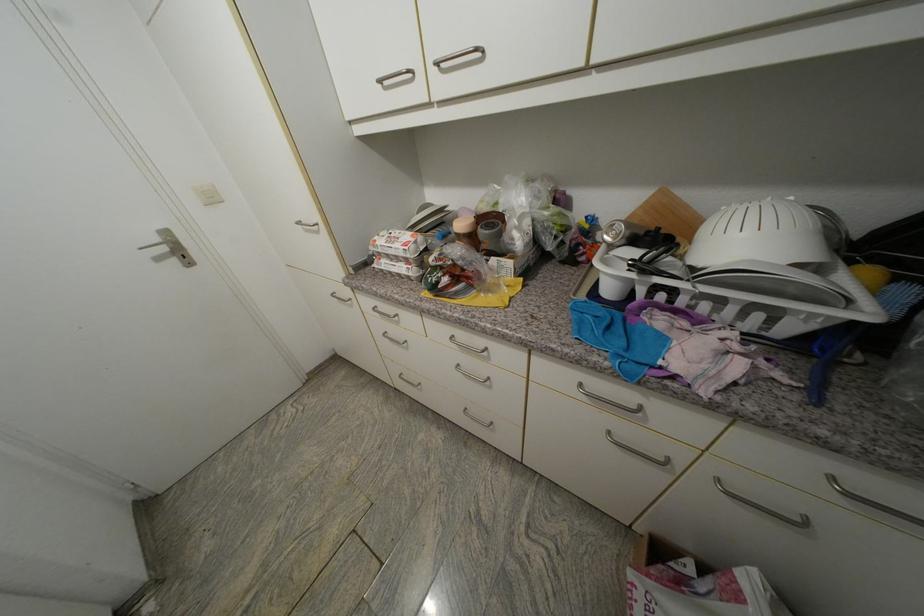
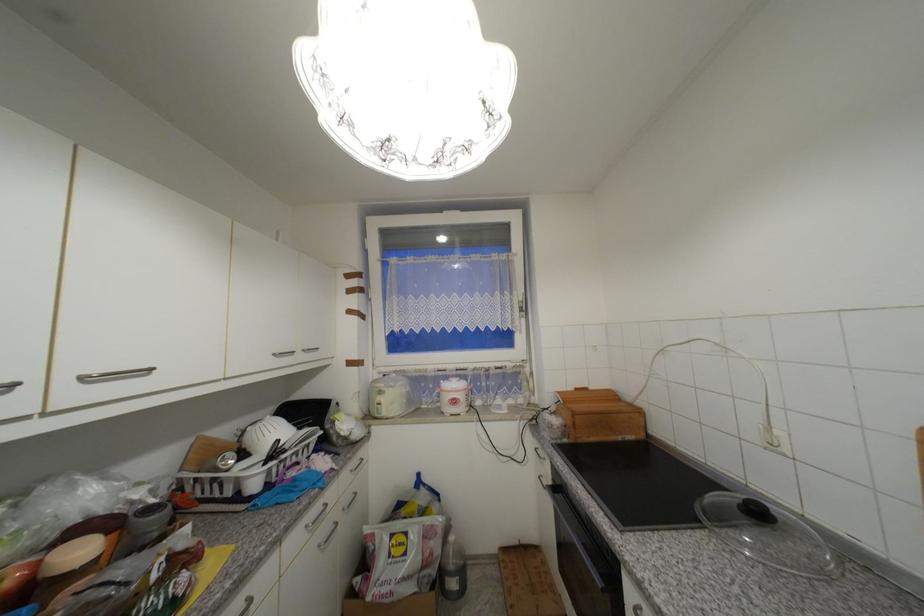
Locate, in the second image, the point that corresponds to point (444, 67) in the first image.

(89, 379)